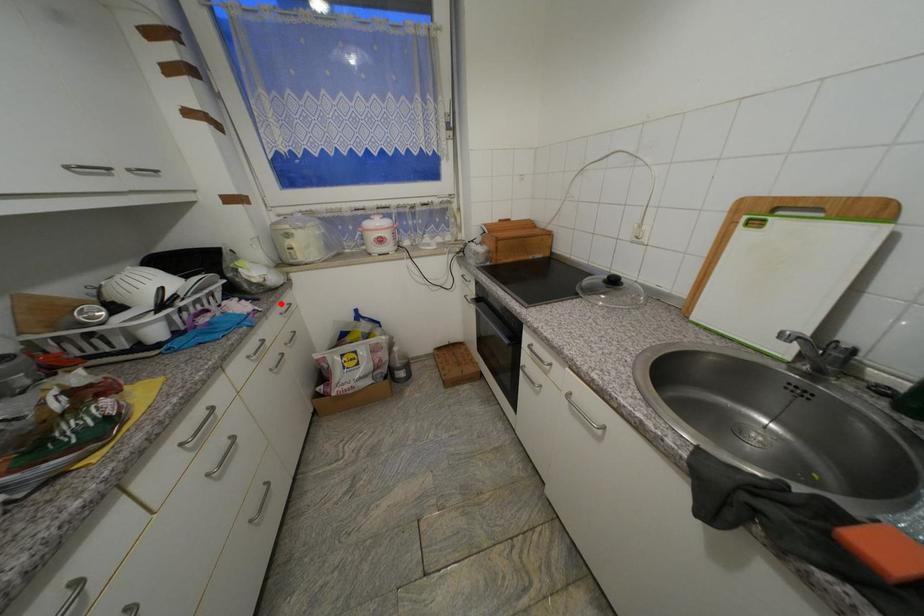
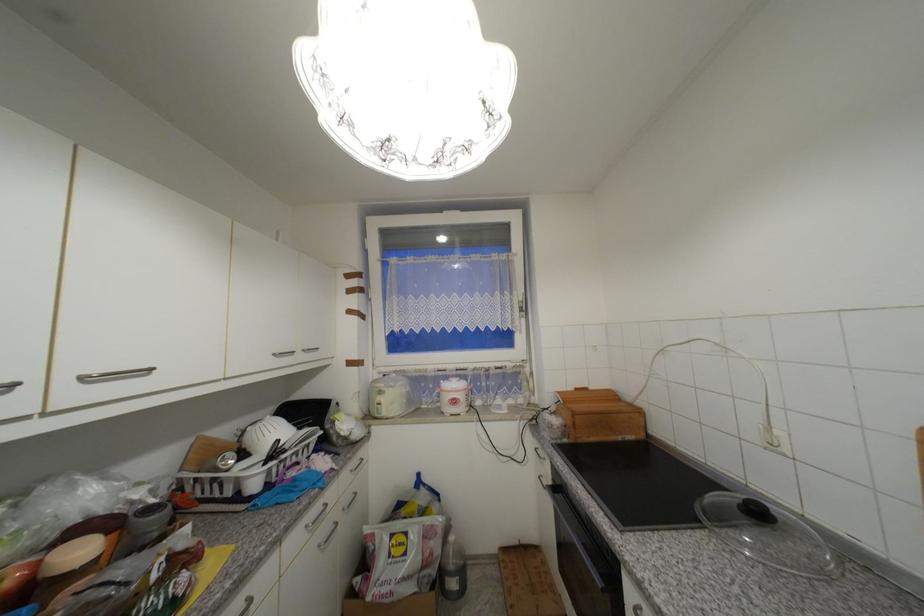
Where in the second image is the point corresponding to the highlighted location from the first image?

(357, 460)